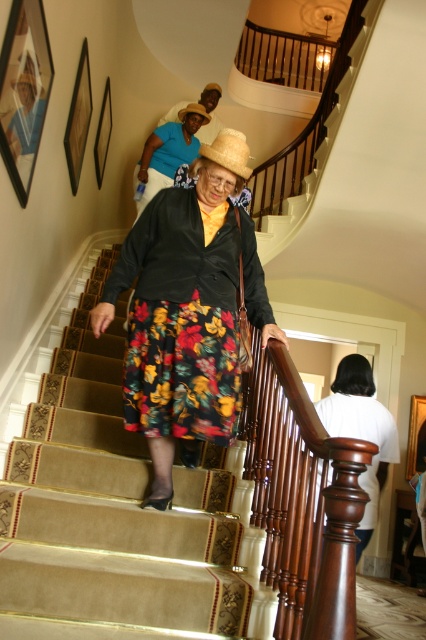
You are standing at the bottom of the staircase and want to place a small potted plant between the two points marked as point (215, 141) and point (195, 108). Which point should the plant be closer to in order to be nearer to you?

The plant should be placed closer to point (215, 141) because it is nearer to the viewer compared to point (195, 108).